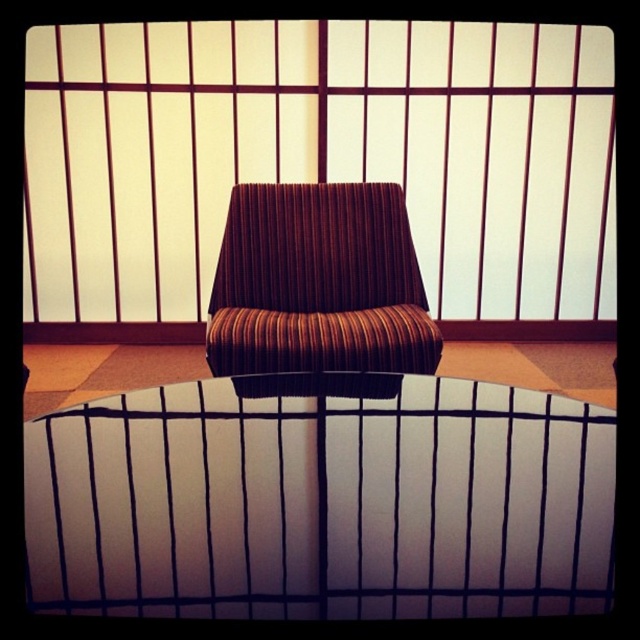
Question: Which point appears farthest from the camera in this image?

Choices:
 (A) (412, 365)
 (B) (349, 104)

Answer: (B)

Question: In this image, where is brown striped cushion at center located relative to brown striped fabric armchair at center?

Choices:
 (A) above
 (B) below

Answer: (A)

Question: Is brown striped cushion at center below brown striped fabric armchair at center?

Choices:
 (A) yes
 (B) no

Answer: (B)

Question: Does brown striped cushion at center appear on the left side of brown striped fabric armchair at center?

Choices:
 (A) yes
 (B) no

Answer: (B)